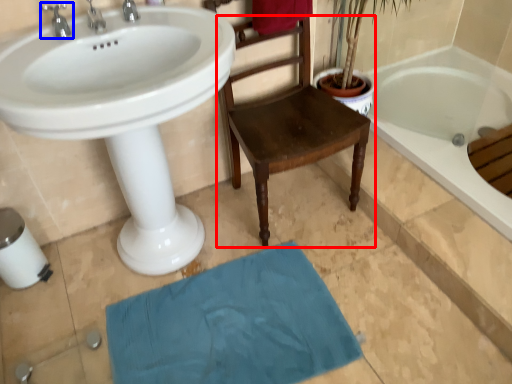
Question: Among these objects, which one is farthest to the camera, chair (highlighted by a red box) or tap (highlighted by a blue box)?

Choices:
 (A) chair
 (B) tap

Answer: (B)